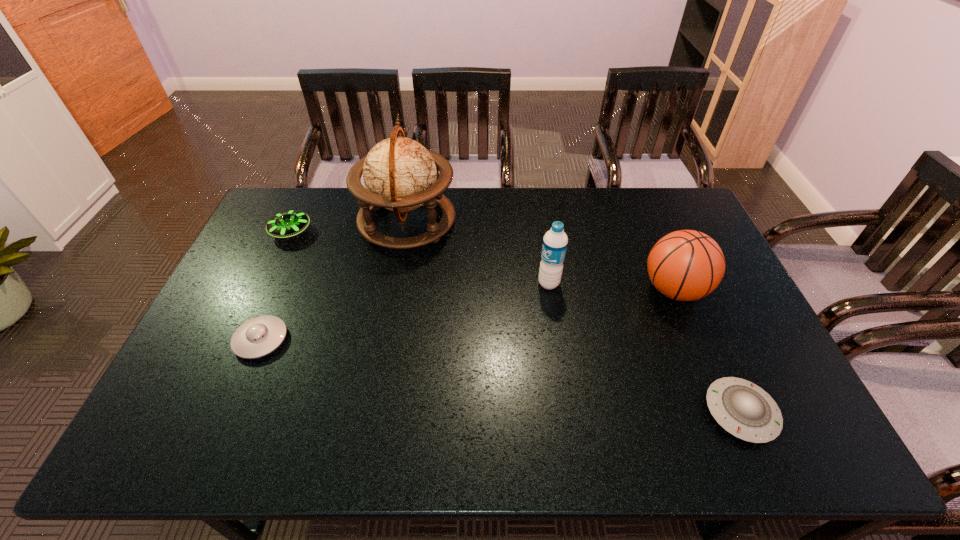
Where is `free space located on the label of the water bottle`? This screenshot has height=540, width=960. free space located on the label of the water bottle is located at coordinates (459, 284).

Identify the location of vacant space located on the label of the water bottle. The height and width of the screenshot is (540, 960). (505, 284).

The width and height of the screenshot is (960, 540). Find the location of `vacant space located on the label of the water bottle`. vacant space located on the label of the water bottle is located at coordinates (501, 284).

Find the location of a particular element. This screenshot has width=960, height=540. blank area located 0.280m on the front of the basketball is located at coordinates (722, 406).

You are a GUI agent. You are given a task and a screenshot of the screen. Output one action in this format:
    pyautogui.click(x=<x>, y=<y>)
    Task: Click on the vacant space located 0.310m on the right of the tallest saucer
    The height and width of the screenshot is (540, 960).
    Given the screenshot: What is the action you would take?
    pyautogui.click(x=401, y=232)

Where is `blank space located 0.180m on the right of the second nearest object`? This screenshot has width=960, height=540. blank space located 0.180m on the right of the second nearest object is located at coordinates (352, 340).

Identify the location of vacant area situated 0.190m on the back of the nearest object. The image size is (960, 540). (701, 322).

Where is `globe present at the far edge`? The height and width of the screenshot is (540, 960). globe present at the far edge is located at coordinates [x=399, y=174].

I want to click on saucer present at the far edge, so click(286, 224).

At what (x,y) coordinates should I click in order to perform the action: click on object that is positioned at the near edge. Please return your answer as a coordinate pair (x, y). Looking at the image, I should click on (745, 410).